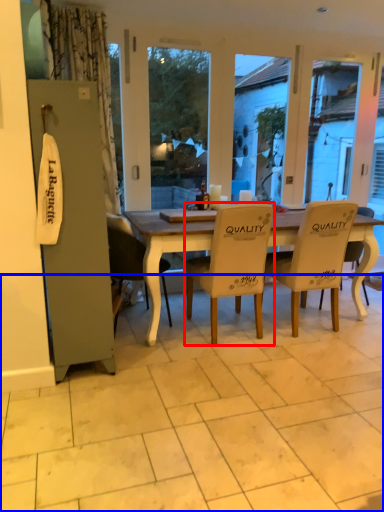
Question: Which object appears farthest to the camera in this image, chair (highlighted by a red box) or tile (highlighted by a blue box)?

Choices:
 (A) chair
 (B) tile

Answer: (A)